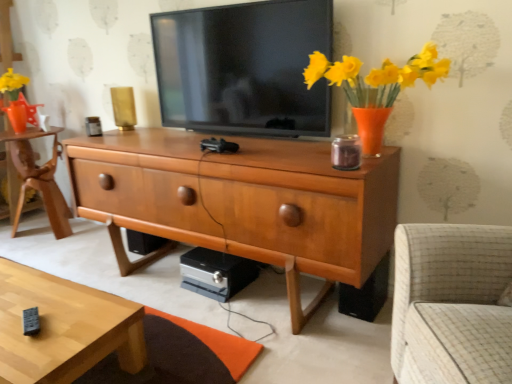
Find the location of a particular element. The height and width of the screenshot is (384, 512). free space to the left of black plastic speaker at lower right is located at coordinates (326, 312).